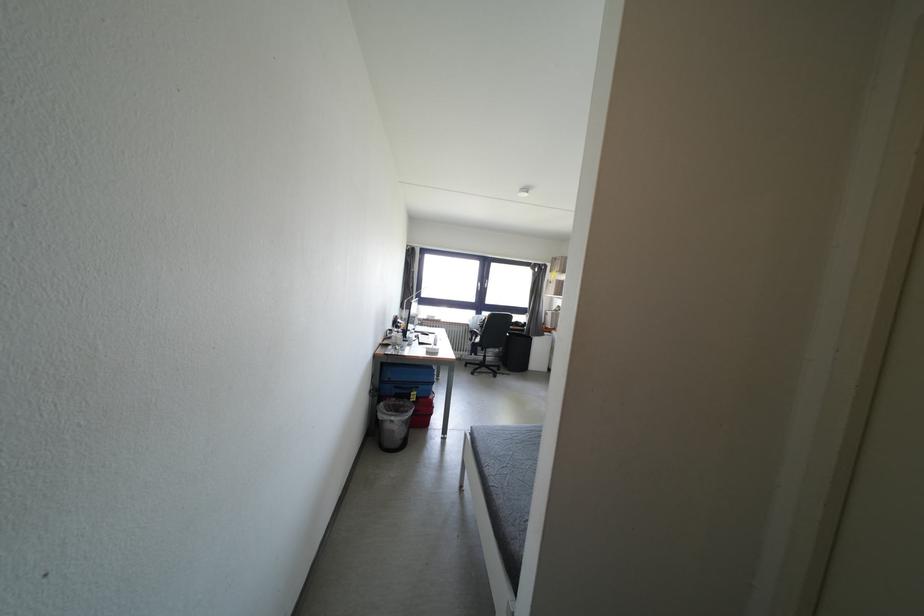
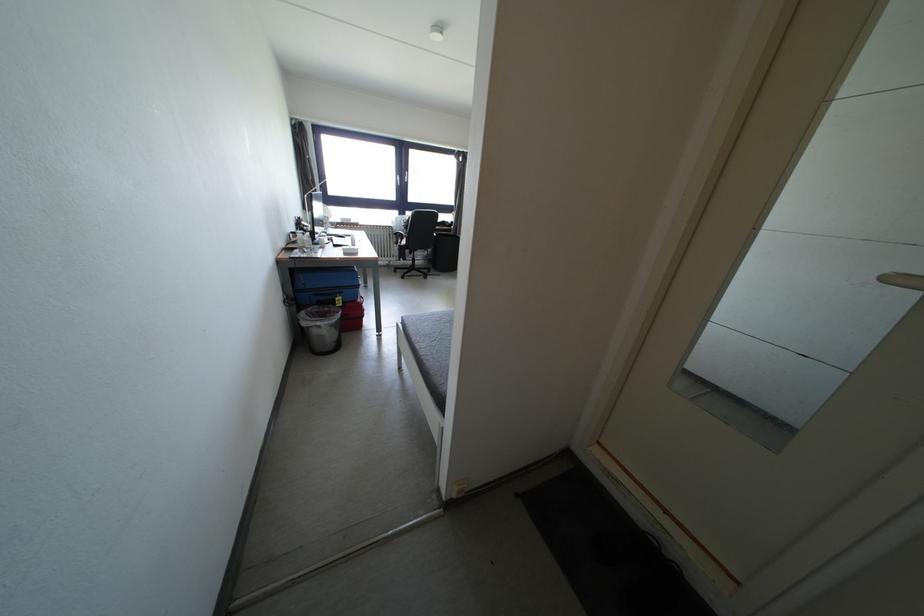
Locate, in the second image, the point that corresponds to point 471,440 in the first image.

(403, 330)